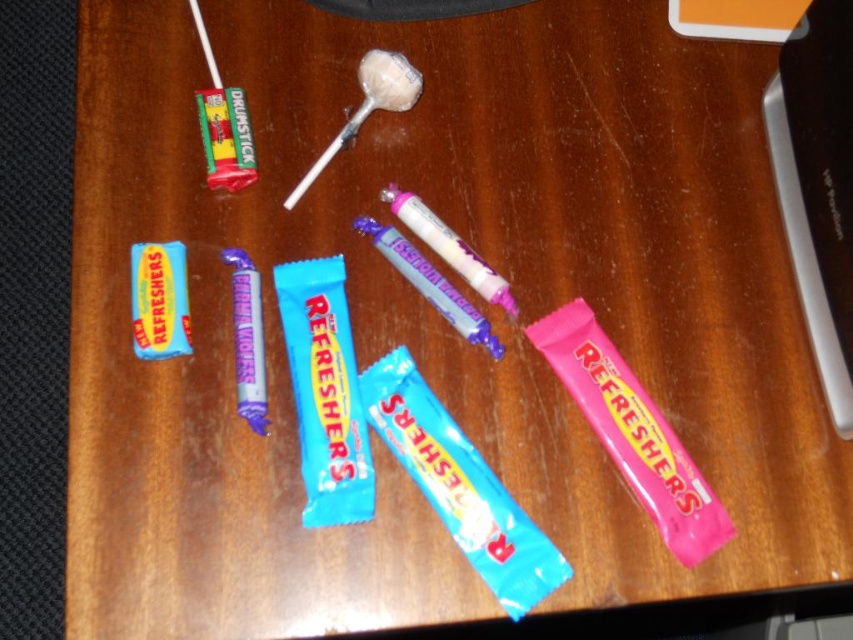
Based on the photo, you are trying to stack the pink matte refreshers bar at center and the blue wrapper candy bar at center vertically. Which one should you place at the bottom to ensure stability?

The pink matte refreshers bar at center has a greater height compared to the blue wrapper candy bar at center, so placing it at the bottom would provide a more stable base for the stack.

You are organizing candies on a shelf and need to place the pink matte refreshers bar at center and the pink glossy lollipop at center in a specific order. According to the arrangement in the image, which candy should be placed to the left to maintain the correct spatial relationship?

The pink glossy lollipop at center should be placed to the left of the pink matte refreshers bar at center to maintain the correct spatial relationship because the pink matte refreshers bar at center is to the right of the pink glossy lollipop at center in the image.

You are holding a candy and want to place it on the wooden surface. If you want to place it closest to the pink matte refreshers bar at center, where should you put it?

To place the candy closest to the pink matte refreshers bar at center, you should put it directly in front of the pink matte refreshers bar at center since it is the closest point to the viewer.